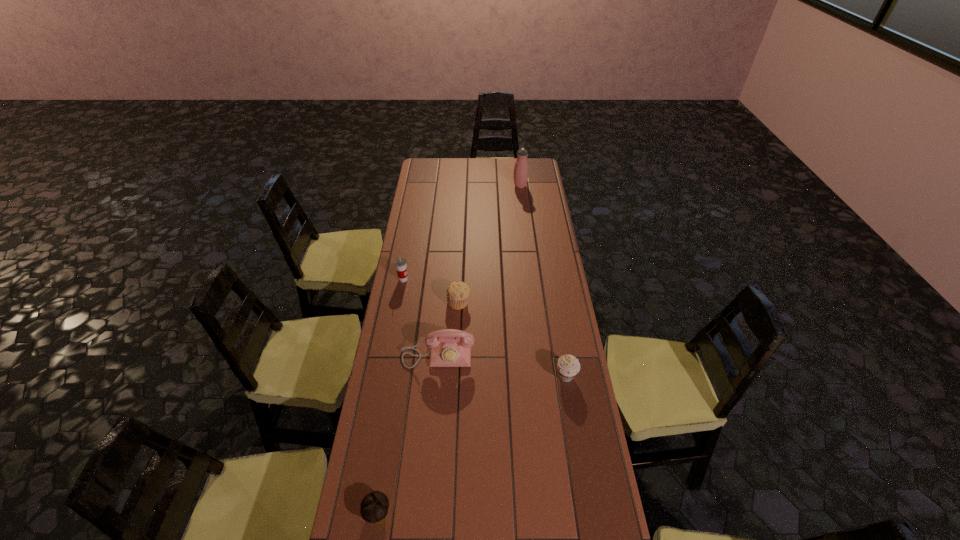
Where is `free space that satisfies the following two spatial constraints: 1. on the front side of the fourth nearest object; 2. on the right side of the rightmost muffin`? The height and width of the screenshot is (540, 960). free space that satisfies the following two spatial constraints: 1. on the front side of the fourth nearest object; 2. on the right side of the rightmost muffin is located at coordinates pyautogui.click(x=456, y=376).

Where is `free location that satisfies the following two spatial constraints: 1. on the side of the cup with the logo; 2. on the left side of the rightmost object`? The height and width of the screenshot is (540, 960). free location that satisfies the following two spatial constraints: 1. on the side of the cup with the logo; 2. on the left side of the rightmost object is located at coordinates (386, 376).

In order to click on vacant area that satisfies the following two spatial constraints: 1. on the back side of the shortest object; 2. on the right side of the second muffin from right to left in this screenshot , I will do `click(410, 302)`.

Where is `free spot that satisfies the following two spatial constraints: 1. on the dial of the telephone; 2. on the right side of the rightmost object`? The height and width of the screenshot is (540, 960). free spot that satisfies the following two spatial constraints: 1. on the dial of the telephone; 2. on the right side of the rightmost object is located at coordinates (436, 376).